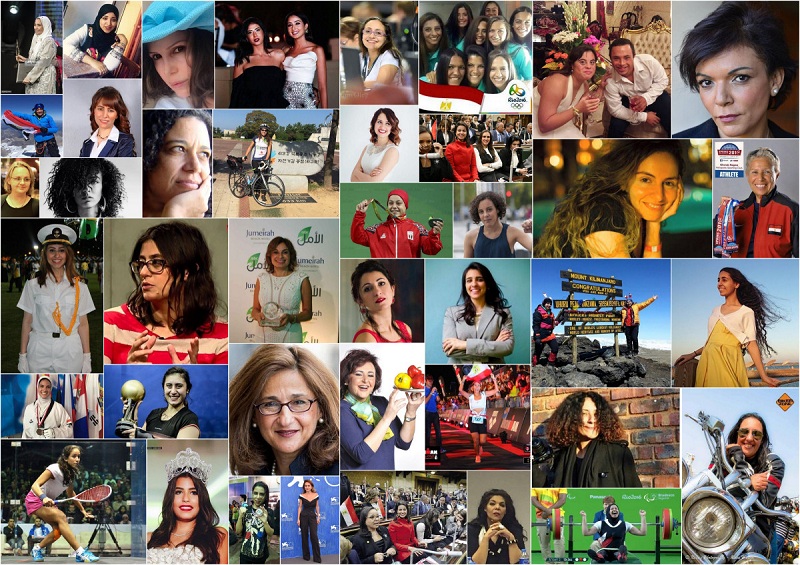
Identify the location of awards. (261, 510), (722, 227), (369, 197), (274, 307), (37, 420), (137, 393).